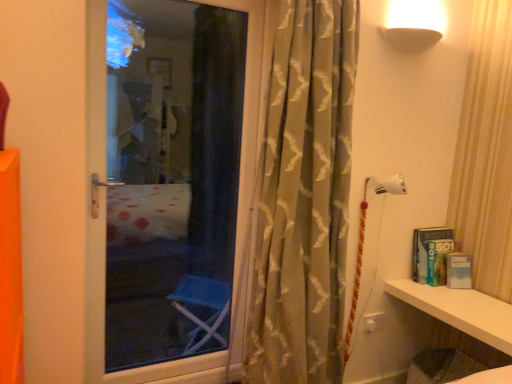
Question: Relative to white glossy shelf at lower right, is silky beige curtain at center in front or behind?

Choices:
 (A) front
 (B) behind

Answer: (A)

Question: Is silky beige curtain at center taller or shorter than white glossy shelf at lower right?

Choices:
 (A) tall
 (B) short

Answer: (A)

Question: Is silky beige curtain at center inside the boundaries of white glossy shelf at lower right, or outside?

Choices:
 (A) inside
 (B) outside

Answer: (B)

Question: Do you think white glossy shelf at lower right is within silky beige curtain at center, or outside of it?

Choices:
 (A) outside
 (B) inside

Answer: (A)

Question: Visually, is white glossy shelf at lower right positioned to the left or to the right of silky beige curtain at center?

Choices:
 (A) right
 (B) left

Answer: (A)

Question: From a real-world perspective, is white glossy shelf at lower right positioned above or below silky beige curtain at center?

Choices:
 (A) below
 (B) above

Answer: (A)

Question: Considering the positions of white glossy shelf at lower right and silky beige curtain at center in the image, is white glossy shelf at lower right taller or shorter than silky beige curtain at center?

Choices:
 (A) short
 (B) tall

Answer: (A)